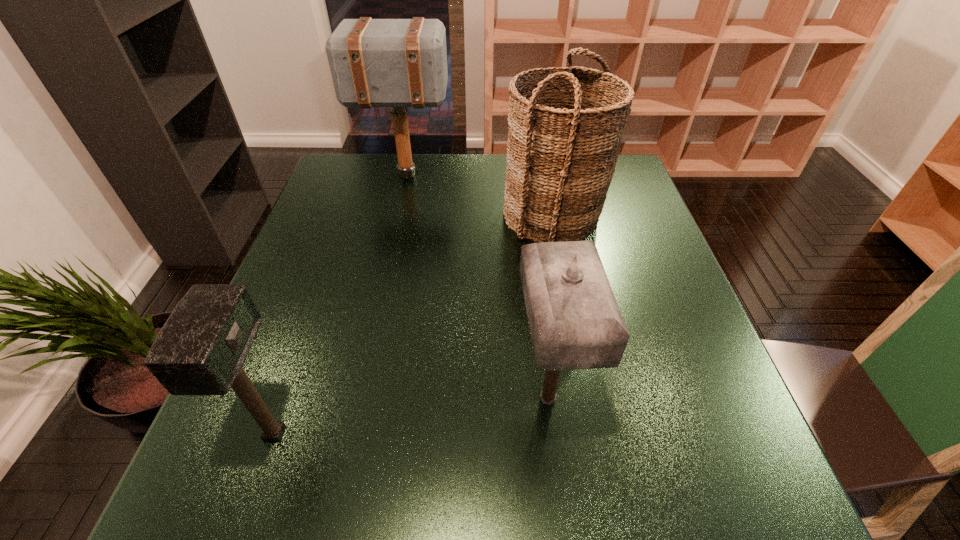
Identify the location of vacant region at the near left corner of the desktop. (279, 514).

In the image, there is a desktop. Identify the location of vacant space at the far right corner. (620, 170).

What are the coordinates of `free location at the near right corner of the desktop` in the screenshot? It's located at (740, 513).

What are the coordinates of `free space that is in between the rightmost mallet and the farthest mallet` in the screenshot? It's located at (477, 287).

You are a GUI agent. You are given a task and a screenshot of the screen. Output one action in this format:
    pyautogui.click(x=<x>, y=<y>)
    Task: Click on the unoccupied position between the basket and the farthest mallet
    The height and width of the screenshot is (540, 960).
    Given the screenshot: What is the action you would take?
    pyautogui.click(x=480, y=195)

At what (x,y) coordinates should I click in order to perform the action: click on blank region between the basket and the shortest object. Please return your answer as a coordinate pair (x, y). Image resolution: width=960 pixels, height=540 pixels. Looking at the image, I should click on (414, 325).

Find the location of a particular element. This screenshot has width=960, height=540. vacant point located between the farthest mallet and the basket is located at coordinates (480, 195).

Locate an element on the screen. This screenshot has width=960, height=540. empty space that is in between the rightmost mallet and the shortest mallet is located at coordinates (412, 416).

This screenshot has height=540, width=960. Identify the location of vacant point located between the rightmost mallet and the farthest mallet. (477, 287).

Locate an element on the screen. This screenshot has width=960, height=540. free space between the farthest mallet and the shortest mallet is located at coordinates (341, 305).